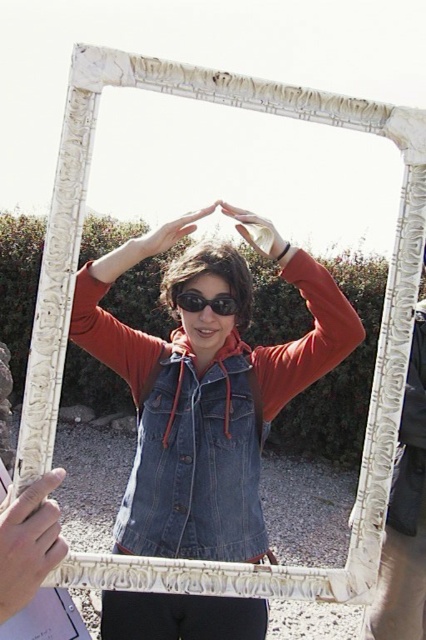
Who is positioned more to the left, denim jacket at center or black plastic goggles at center?

denim jacket at center is more to the left.

The height and width of the screenshot is (640, 426). Find the location of `denim jacket at center`. denim jacket at center is located at coordinates (206, 388).

Measure the distance between point (236, 403) and camera.

The distance of point (236, 403) from camera is 1.54 meters.

Find the location of a particular element. The height and width of the screenshot is (640, 426). denim jacket at center is located at coordinates (206, 388).

Is point (204, 554) farther from camera compared to point (420, 388)?

That is False.

Based on the photo, between faded denim jacket at center and white carved frame at center, which one has less height?

Standing shorter between the two is faded denim jacket at center.

Is point (215, 384) less distant than point (382, 573)?

Yes, point (215, 384) is closer to viewer.

At what (x,y) coordinates should I click in order to perform the action: click on faded denim jacket at center. Please return your answer as a coordinate pair (x, y). Looking at the image, I should click on (x=195, y=464).

Can you confirm if denim jacket at center is positioned above faded denim jacket at center?

Yes.

Between point (221, 317) and point (167, 417), which one is positioned in front?

Point (167, 417) is more forward.

I want to click on denim jacket at center, so click(206, 388).